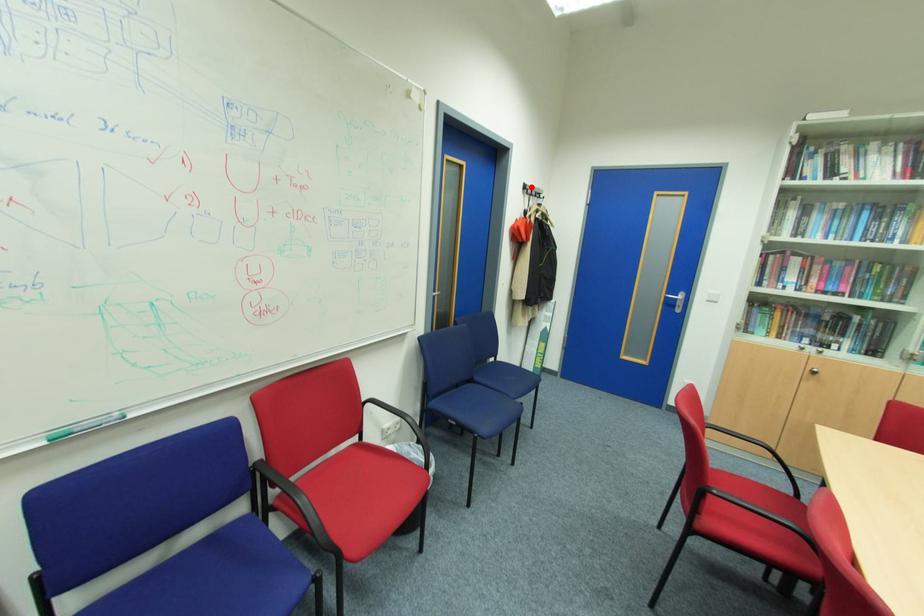
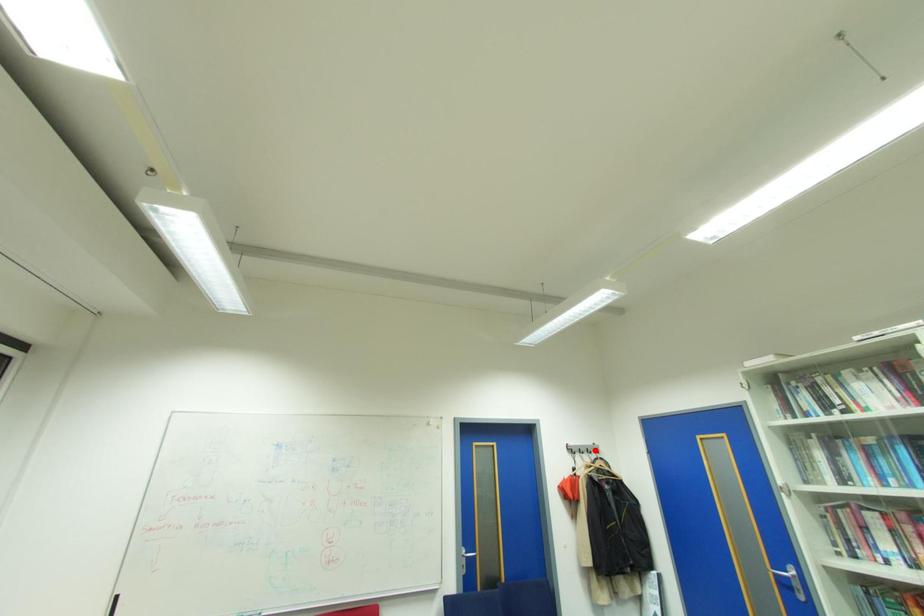
I am providing you with two images of the same scene from different viewpoints. A red point is marked on the first image and another point is marked on the second image. Are the points marked in image1 and image2 representing the same 3D position?

No